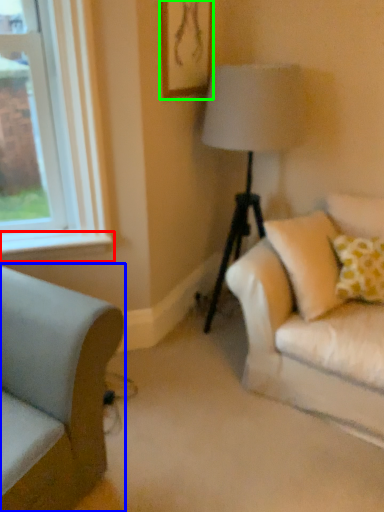
Question: Estimate the real-world distances between objects in this image. Which object is farther from window sill (highlighted by a red box), studio couch (highlighted by a blue box) or picture frame (highlighted by a green box)?

Choices:
 (A) studio couch
 (B) picture frame

Answer: (B)